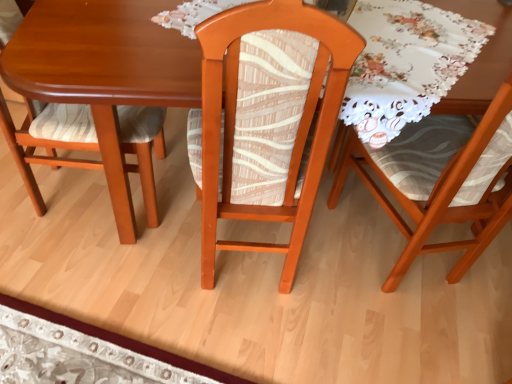
I want to click on empty space that is to the right of wooden chair at center, which appears as the second chair when viewed from the right, so click(336, 278).